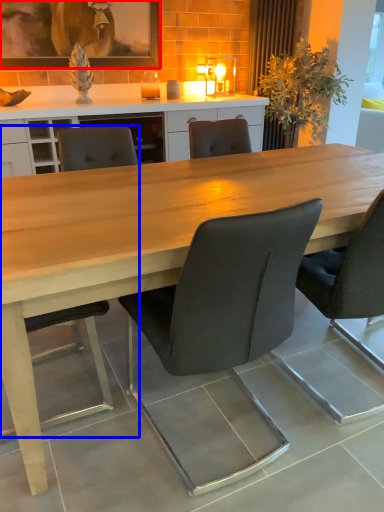
Question: Among these objects, which one is nearest to the camera, picture frame (highlighted by a red box) or chair (highlighted by a blue box)?

Choices:
 (A) picture frame
 (B) chair

Answer: (B)